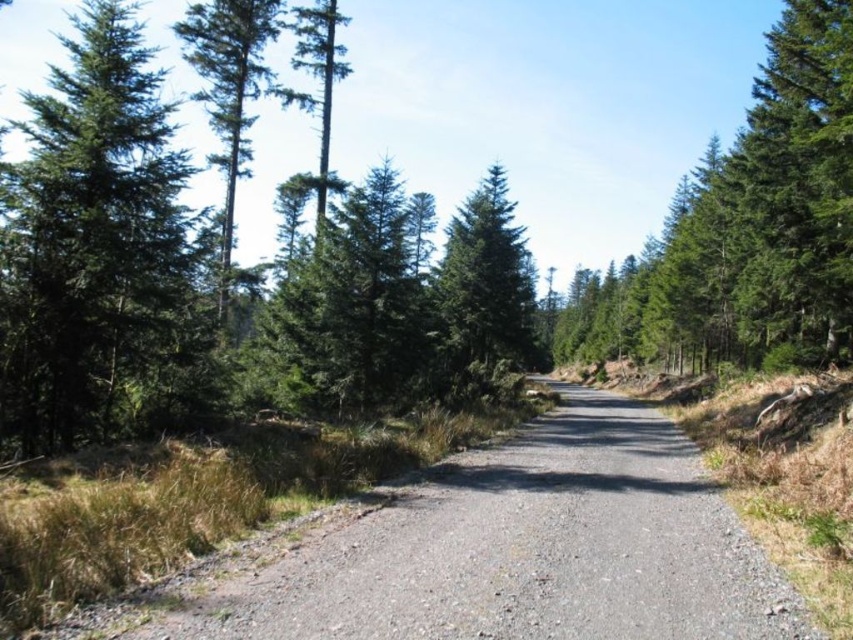
Question: Which of the following is the closest to the observer?

Choices:
 (A) gray gravel road at center
 (B) green needle-like trees at left
 (C) green matte tree at upper right

Answer: (A)

Question: Can you confirm if green needle-like trees at left is positioned above green matte tree at upper right?

Choices:
 (A) yes
 (B) no

Answer: (B)

Question: Which object appears farthest from the camera in this image?

Choices:
 (A) gray gravel road at center
 (B) green matte tree at center
 (C) green matte tree at left

Answer: (B)

Question: Which point is closer to the camera taking this photo?

Choices:
 (A) (451, 381)
 (B) (138, 164)

Answer: (B)

Question: Can you confirm if green needle-like trees at left is positioned to the right of green matte tree at center?

Choices:
 (A) no
 (B) yes

Answer: (A)

Question: Is green matte tree at left positioned before green matte tree at upper right?

Choices:
 (A) yes
 (B) no

Answer: (A)